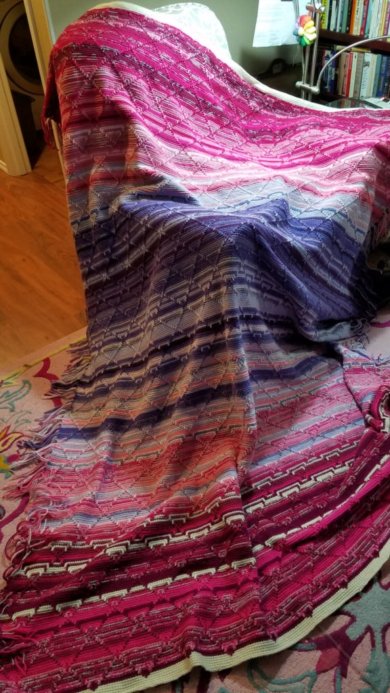
Find the location of a particular element. Image resolution: width=390 pixels, height=693 pixels. drape is located at coordinates (247, 479).